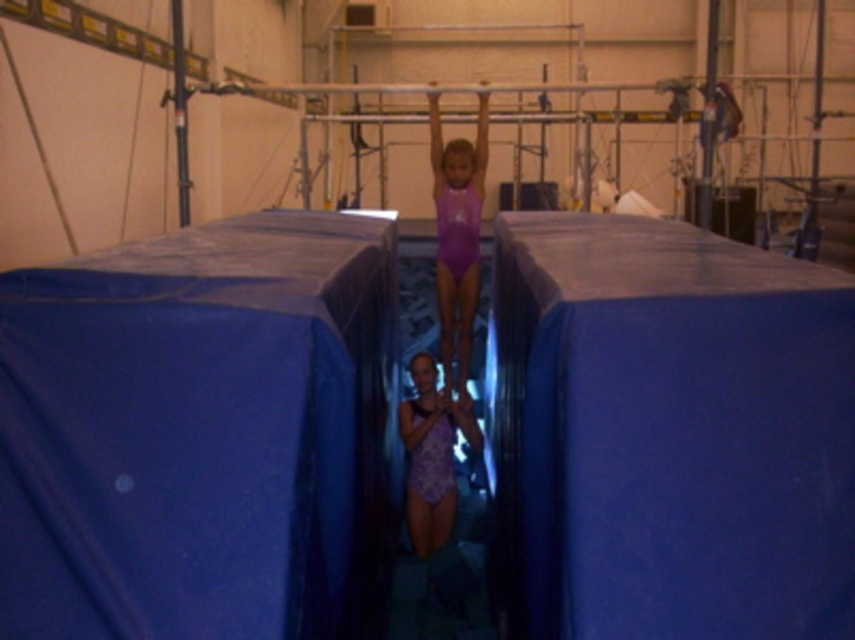
Question: Is blue fabric mat at center positioned before purple matte swimsuit at center?

Choices:
 (A) yes
 (B) no

Answer: (A)

Question: Which object appears farthest from the camera in this image?

Choices:
 (A) blue fabric mat at center
 (B) purple matte swimsuit at center

Answer: (B)

Question: Can you confirm if blue fabric mat at center is positioned below purple matte swimsuit at center?

Choices:
 (A) yes
 (B) no

Answer: (A)

Question: Which of the following is the farthest from the observer?

Choices:
 (A) (453, 173)
 (B) (847, 518)

Answer: (A)

Question: Is purple matte swimsuit at center to the right of purple textured leotard at center from the viewer's perspective?

Choices:
 (A) no
 (B) yes

Answer: (B)

Question: Among these points, which one is farthest from the camera?

Choices:
 (A) (299, 339)
 (B) (444, 484)
 (C) (435, 124)

Answer: (C)